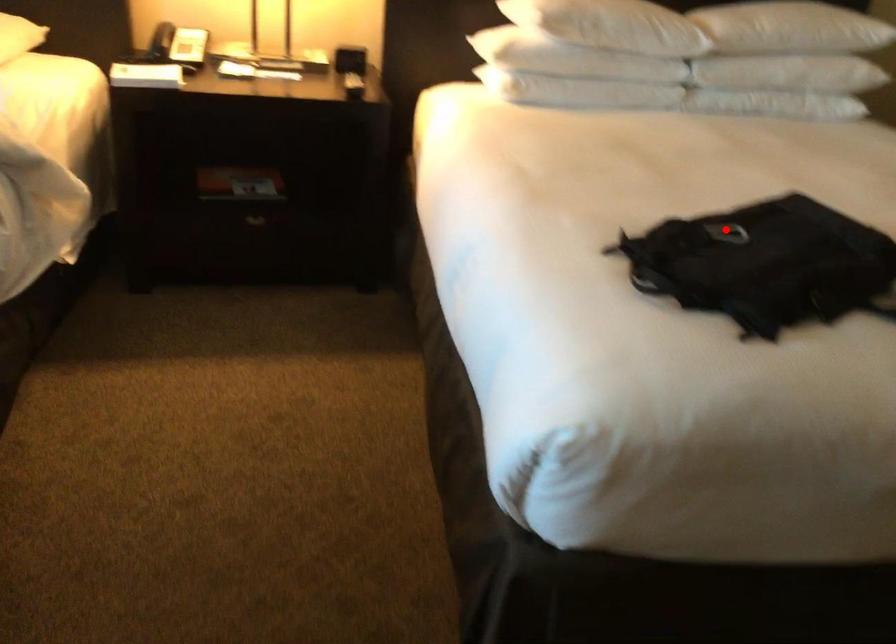
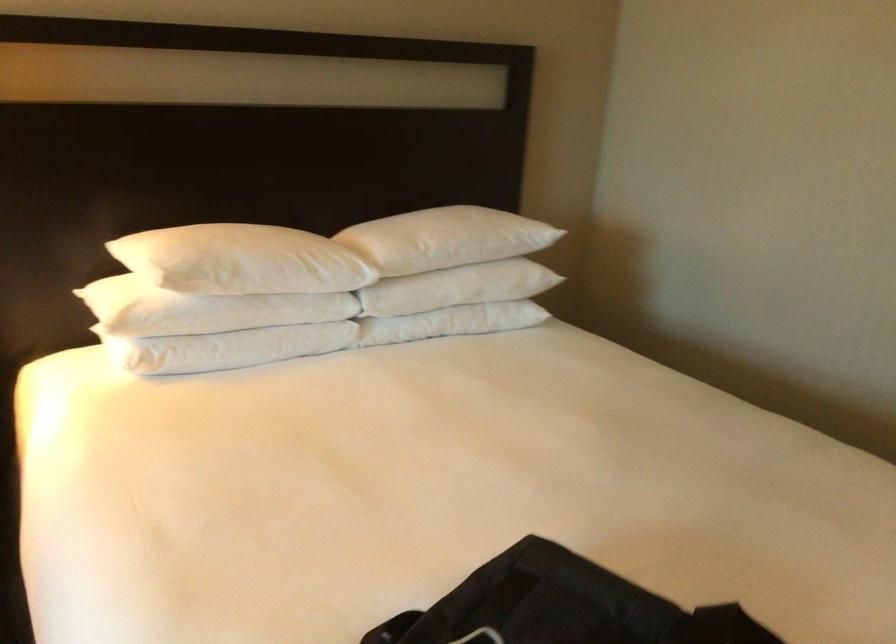
The point at the highlighted location is marked in the first image. Where is the corresponding point in the second image?

(480, 637)